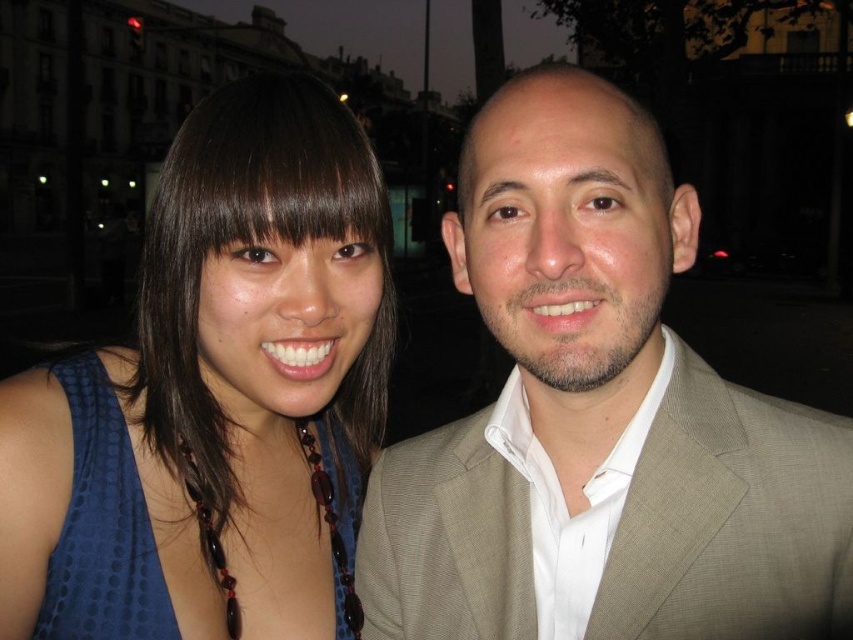
Question: Which is farther from the brown hair at upper center?

Choices:
 (A) blue fabric dress at left
 (B) blue dotted fabric dress at left
 (C) tan textured suit at center

Answer: (B)

Question: Does blue dotted fabric dress at left have a lesser width compared to brown hair at upper center?

Choices:
 (A) no
 (B) yes

Answer: (B)

Question: Which of these objects is positioned farthest from the tan textured suit at center?

Choices:
 (A) blue dotted fabric dress at left
 (B) brown hair at upper center
 (C) blue fabric dress at left

Answer: (A)

Question: Which of the following is the farthest from the observer?

Choices:
 (A) brown hair at upper center
 (B) tan textured suit at center
 (C) blue fabric dress at left

Answer: (C)

Question: Can you confirm if tan textured suit at center is wider than blue dotted fabric dress at left?

Choices:
 (A) yes
 (B) no

Answer: (A)

Question: Does blue dotted fabric dress at left appear on the left side of brown hair at upper center?

Choices:
 (A) yes
 (B) no

Answer: (A)